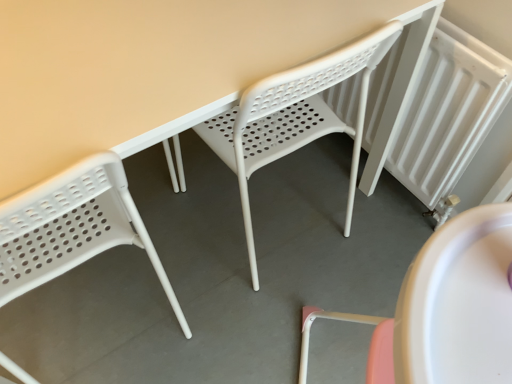
At what (x,y) coordinates should I click in order to perform the action: click on vacant area situated to the left side of white plastic chair at center, which is counted as the second chair, starting from the left. Please return your answer as a coordinate pair (x, y). This screenshot has height=384, width=512. Looking at the image, I should click on (174, 208).